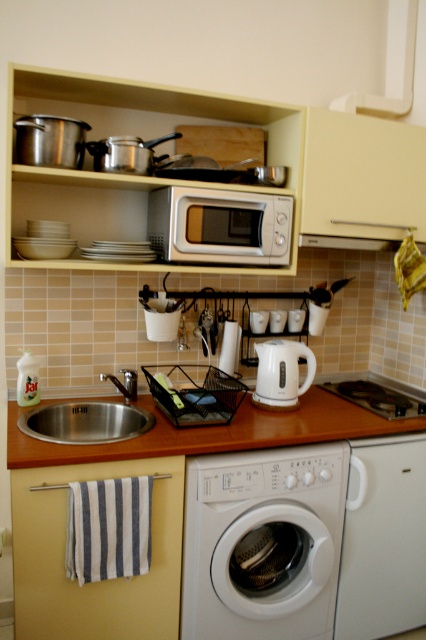
Between wooden at center and white glossy electric kettle at center, which one is positioned lower?

Positioned lower is wooden at center.

Can you confirm if wooden at center is thinner than white glossy electric kettle at center?

No.

Locate an element on the screen. This screenshot has height=640, width=426. wooden at center is located at coordinates (215, 433).

Which is more to the right, silver metallic microwave at center or white glossy electric kettle at center?

white glossy electric kettle at center is more to the right.

Which is above, silver metallic microwave at center or white glossy electric kettle at center?

Positioned higher is silver metallic microwave at center.

Is point (230, 237) closer to viewer compared to point (258, 356)?

Yes, it is in front of point (258, 356).

Where is `silver metallic microwave at center`? The image size is (426, 640). silver metallic microwave at center is located at coordinates (219, 227).

Does wooden at center appear under white plastic exhaust hood at upper center?

Yes, wooden at center is below white plastic exhaust hood at upper center.

Between point (282, 420) and point (339, 236), which one is positioned behind?

The point (339, 236) is behind.

Is point (252, 438) positioned in front of point (327, 236)?

Yes, it is in front of point (327, 236).

Where is `wooden at center`? The image size is (426, 640). wooden at center is located at coordinates (215, 433).